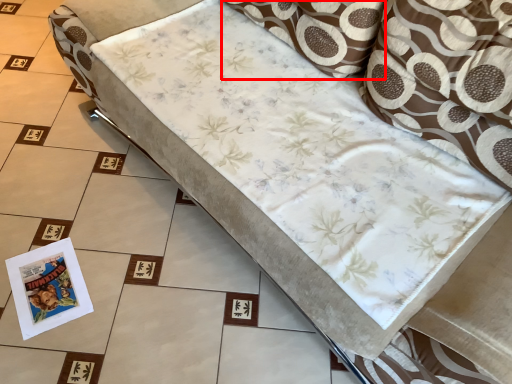
Question: Where is pillow (annotated by the red box) located in relation to throw pillow in the image?

Choices:
 (A) left
 (B) right

Answer: (A)